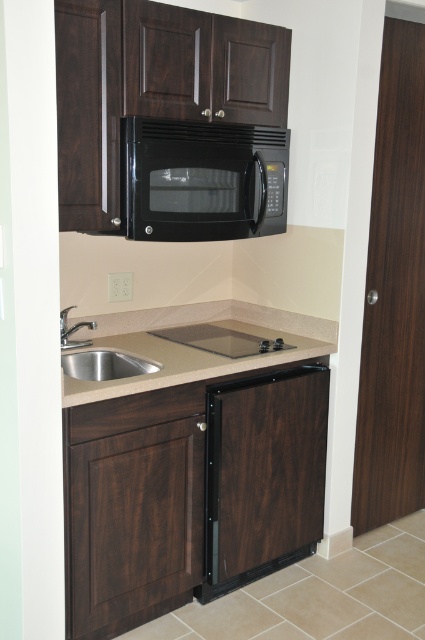
Which is above, beige laminate countertop at lower center or stainless steel sink at lower left?

beige laminate countertop at lower center is above.

Who is more forward, (146, 324) or (70, 362)?

Point (70, 362)

Locate an element on the screen. The width and height of the screenshot is (425, 640). beige laminate countertop at lower center is located at coordinates (193, 348).

Does black matte microwave at upper center have a greater height compared to transparent glass cooktop at center?

Yes.

How distant is black matte microwave at upper center from transparent glass cooktop at center?

black matte microwave at upper center and transparent glass cooktop at center are 23.71 inches apart from each other.

Does point (204, 128) come closer to viewer compared to point (180, 340)?

Yes, point (204, 128) is in front of point (180, 340).

Find the location of a particular element. black matte microwave at upper center is located at coordinates (201, 179).

Is beige laminate countertop at lower center to the left of silver metallic faucet at lower left from the viewer's perspective?

In fact, beige laminate countertop at lower center is to the right of silver metallic faucet at lower left.

Does beige laminate countertop at lower center appear over silver metallic faucet at lower left?

Incorrect, beige laminate countertop at lower center is not positioned above silver metallic faucet at lower left.

Describe the element at coordinates (193, 348) in the screenshot. I see `beige laminate countertop at lower center` at that location.

The width and height of the screenshot is (425, 640). I want to click on beige laminate countertop at lower center, so click(193, 348).